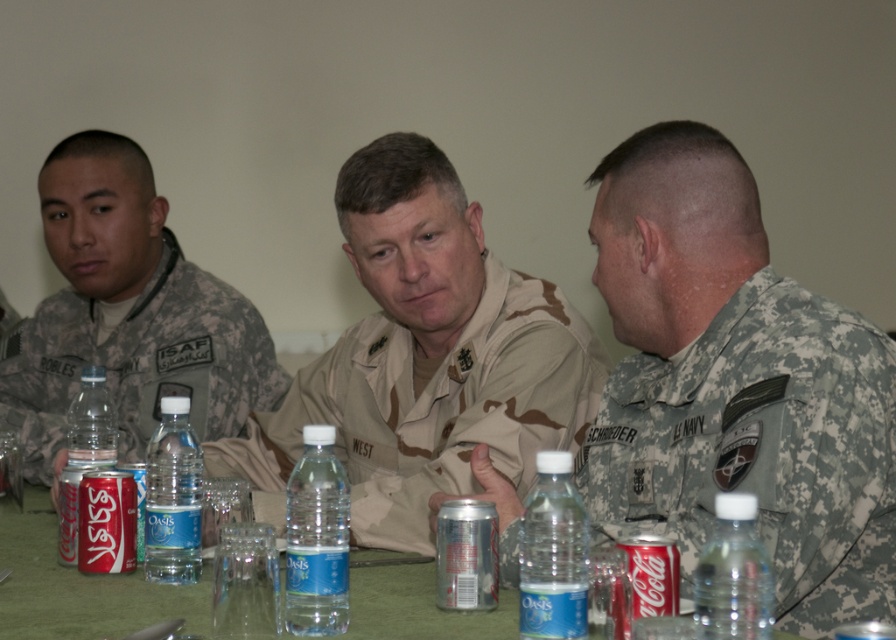
What is the 2D coordinate of the camouflage uniform at center?

The 2D coordinate of the camouflage uniform at center is at point (737,385).

You are a photographer positioned at the center of the scene. You want to take a photo focusing on the point at coordinates point (550, 570) and point (119, 547). Which of these points will appear larger in your photo?

Point (550, 570) is closer to the viewer than point (119, 547), so it will appear larger in the photo.